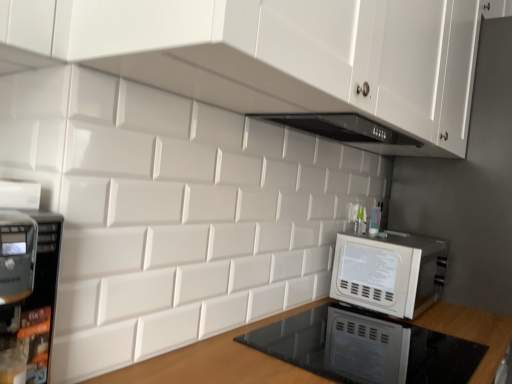
Question: Is point (493, 1) positioned closer to the camera than point (419, 324)?

Choices:
 (A) farther
 (B) closer

Answer: (A)

Question: In terms of size, does white glossy cabinet at upper center appear bigger or smaller than wooden at lower center?

Choices:
 (A) small
 (B) big

Answer: (A)

Question: Which object is positioned farthest from the white glossy cabinet at upper center?

Choices:
 (A) white glossy microwave at right
 (B) wooden at lower center

Answer: (B)

Question: Which object is the closest to the wooden at lower center?

Choices:
 (A) white glossy cabinet at upper center
 (B) white glossy microwave at right

Answer: (B)